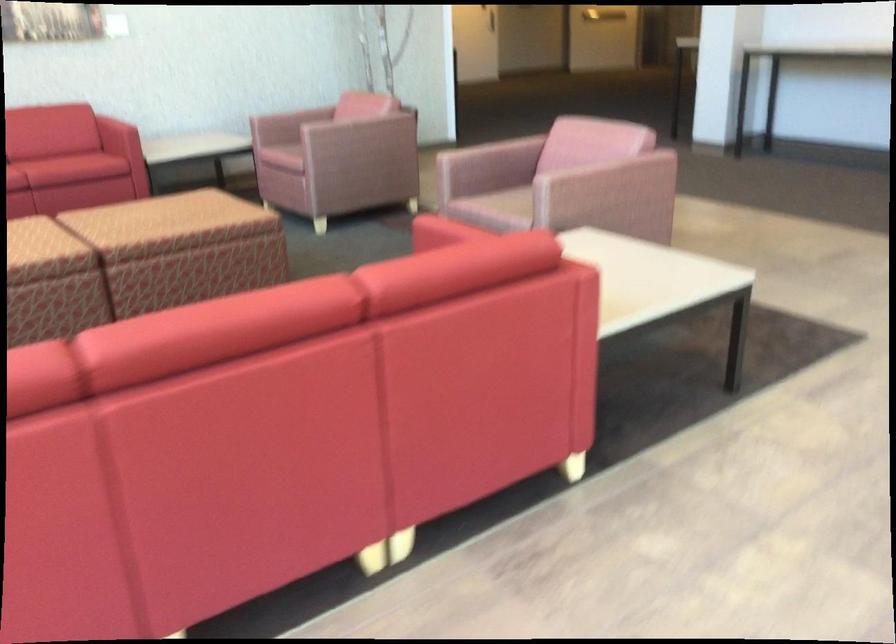
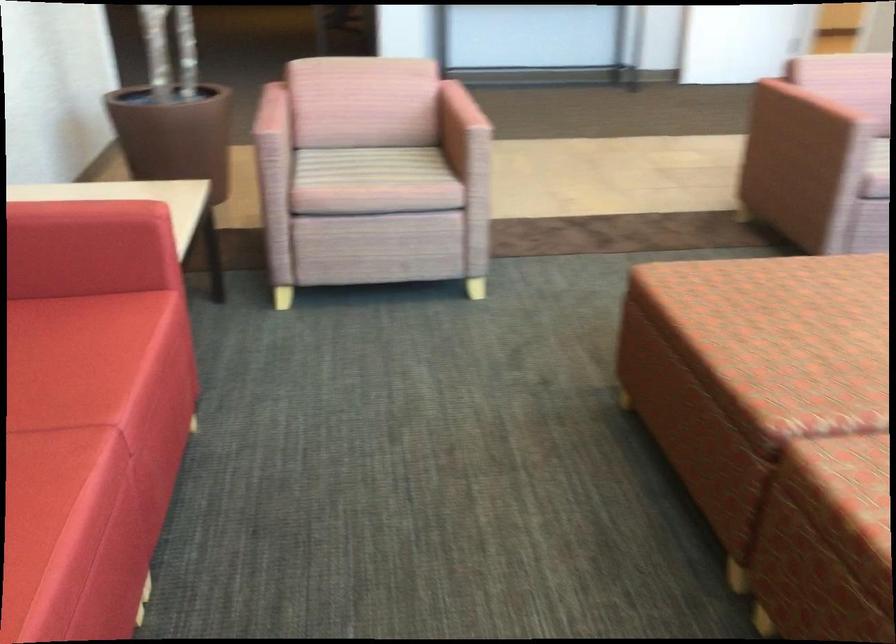
The point at (495, 147) is marked in the first image. Where is the corresponding point in the second image?

(810, 108)